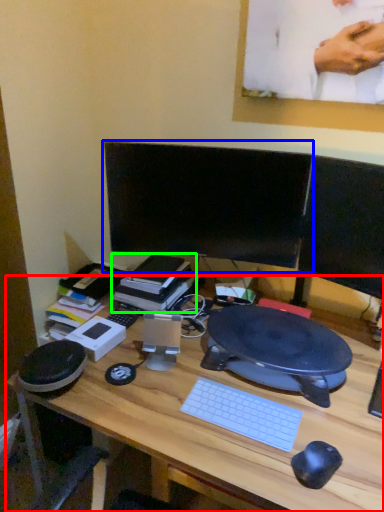
Question: Which object is the closest to the desk (highlighted by a red box)? Choose among these: computer monitor (highlighted by a blue box) or book (highlighted by a green box).

Choices:
 (A) computer monitor
 (B) book

Answer: (B)